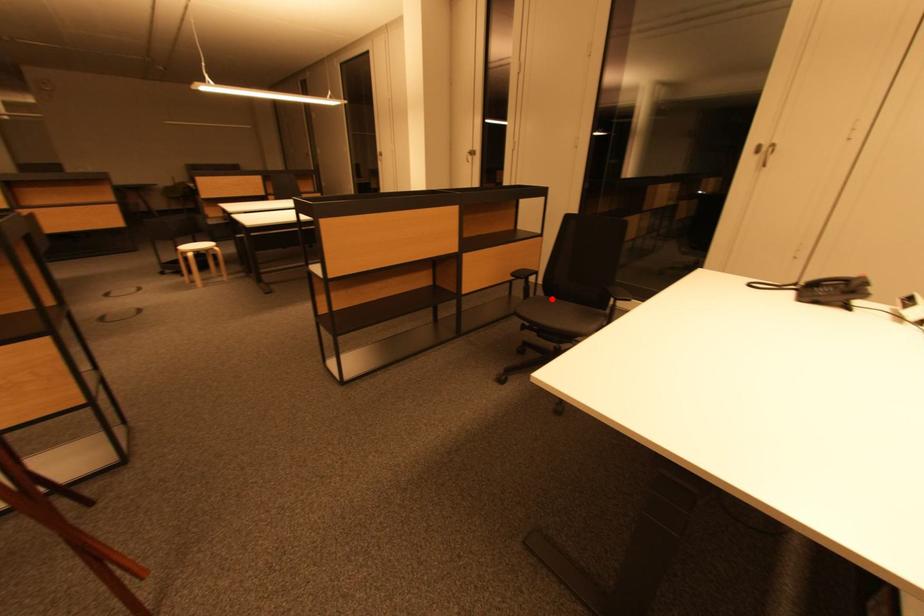
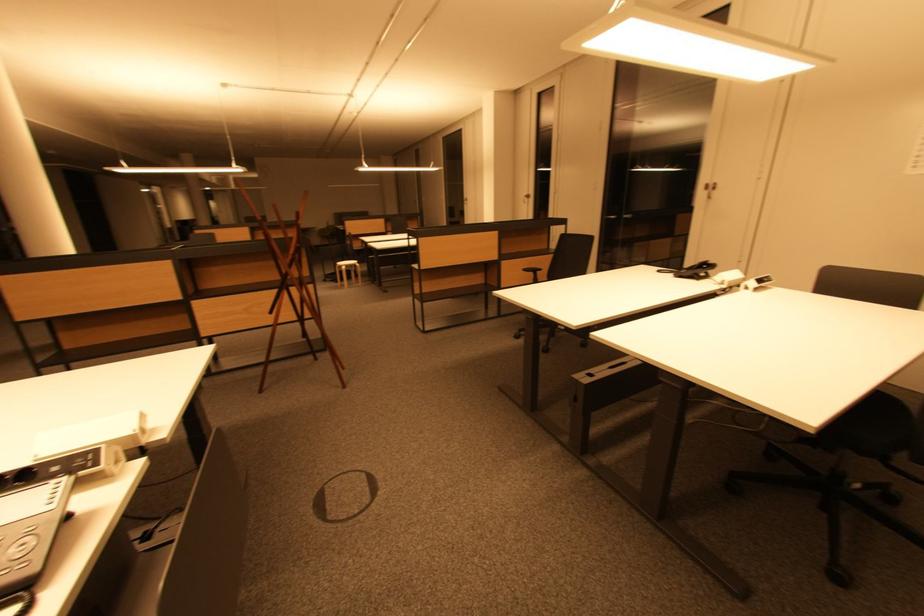
Question: I am providing you with two images of the same scene from different viewpoints. A red point is marked on the first image. At the location where the point appears in image 1, is it still visible in image 2?

Choices:
 (A) Yes
 (B) No

Answer: (B)